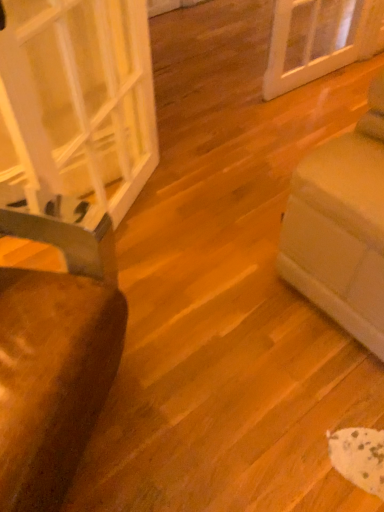
What do you see at coordinates (55, 353) in the screenshot?
I see `brown fabric chair at left` at bounding box center [55, 353].

Identify the location of brown fabric chair at left. (55, 353).

The height and width of the screenshot is (512, 384). Find the location of `transparent glass door at left`. transparent glass door at left is located at coordinates (78, 98).

Describe the element at coordinates (78, 98) in the screenshot. This screenshot has height=512, width=384. I see `transparent glass door at left` at that location.

You are a GUI agent. You are given a task and a screenshot of the screen. Output one action in this format:
    pyautogui.click(x=<x>, y=<y>)
    Task: Click on the brown fabric chair at left
    The height and width of the screenshot is (512, 384).
    Given the screenshot: What is the action you would take?
    pyautogui.click(x=55, y=353)

Is transparent glass door at left at the left side of brown fabric chair at left?

In fact, transparent glass door at left is to the right of brown fabric chair at left.

Is transparent glass door at left further to the viewer compared to brown fabric chair at left?

Yes, transparent glass door at left is further from the viewer.

Does point (98, 41) come farther from viewer compared to point (49, 490)?

That is True.

From the image's perspective, is transparent glass door at left on top of brown fabric chair at left?

Yes, from the image's perspective, transparent glass door at left is above brown fabric chair at left.

From a real-world perspective, which object rests below the other?

brown fabric chair at left is physically lower.

In terms of width, does transparent glass door at left look wider or thinner when compared to brown fabric chair at left?

In the image, transparent glass door at left appears to be more narrow than brown fabric chair at left.

Who is shorter, transparent glass door at left or brown fabric chair at left?

With less height is brown fabric chair at left.

Does transparent glass door at left have a larger size compared to brown fabric chair at left?

No.

Is transparent glass door at left completely or partially outside of brown fabric chair at left?

Yes, transparent glass door at left is outside of brown fabric chair at left.

Can you see transparent glass door at left touching brown fabric chair at left?

No, transparent glass door at left is not touching brown fabric chair at left.

Is transparent glass door at left oriented away from brown fabric chair at left?

No, brown fabric chair at left is not at the back of transparent glass door at left.

Find the location of a particular element. furniture in front of the transparent glass door at left is located at coordinates tap(55, 353).

Based on their positions, is brown fabric chair at left located to the left or right of transparent glass door at left?

brown fabric chair at left is positioned on transparent glass door at left's left side.

Does brown fabric chair at left come in front of transparent glass door at left?

That is True.

Considering the positions of points (22, 421) and (107, 145), is point (22, 421) farther from camera compared to point (107, 145)?

No, (22, 421) is in front of (107, 145).

From the image's perspective, does brown fabric chair at left appear higher than transparent glass door at left?

Actually, brown fabric chair at left appears below transparent glass door at left in the image.

From a real-world perspective, is brown fabric chair at left beneath transparent glass door at left?

Yes, from a real-world perspective, brown fabric chair at left is beneath transparent glass door at left.

Between brown fabric chair at left and transparent glass door at left, which one has larger width?

Wider between the two is brown fabric chair at left.

Considering the sizes of objects brown fabric chair at left and transparent glass door at left in the image provided, who is shorter, brown fabric chair at left or transparent glass door at left?

Standing shorter between the two is brown fabric chair at left.

Which of these two, brown fabric chair at left or transparent glass door at left, is bigger?

Bigger between the two is brown fabric chair at left.

Can transparent glass door at left be found inside brown fabric chair at left?

That's incorrect, transparent glass door at left is not inside brown fabric chair at left.

Is brown fabric chair at left far from transparent glass door at left?

They are positioned close to each other.

Looking at this image, is brown fabric chair at left oriented away from transparent glass door at left?

No, transparent glass door at left is not at the back of brown fabric chair at left.

At what (x,y) coordinates should I click in order to perform the action: click on glass door that is on the right side of brown fabric chair at left. Please return your answer as a coordinate pair (x, y). The width and height of the screenshot is (384, 512). Looking at the image, I should click on (78, 98).

At what (x,y) coordinates should I click in order to perform the action: click on furniture located in front of the transparent glass door at left. Please return your answer as a coordinate pair (x, y). Looking at the image, I should click on (55, 353).

Identify the location of furniture below the transparent glass door at left (from the image's perspective). This screenshot has width=384, height=512. (55, 353).